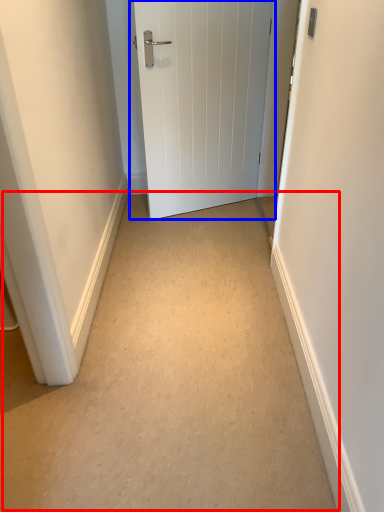
Question: Among these objects, which one is nearest to the camera, path (highlighted by a red box) or door (highlighted by a blue box)?

Choices:
 (A) path
 (B) door

Answer: (A)